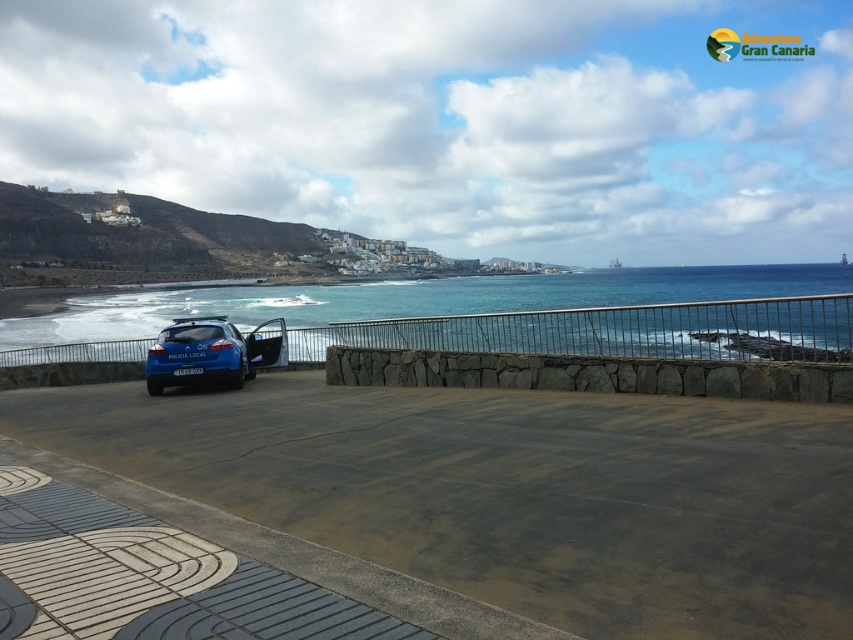
Does blue water at center have a greater width compared to blue matte police car at center?

Indeed, blue water at center has a greater width compared to blue matte police car at center.

Is blue water at center to the right of blue matte police car at center from the viewer's perspective?

Correct, you'll find blue water at center to the right of blue matte police car at center.

What do you see at coordinates (495, 316) in the screenshot? I see `blue water at center` at bounding box center [495, 316].

Locate an element on the screen. blue water at center is located at coordinates (495, 316).